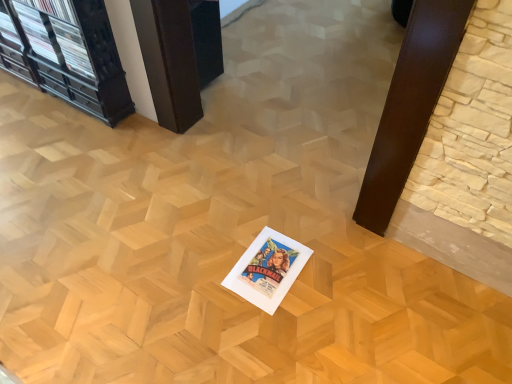
Find the location of a particular element. The height and width of the screenshot is (384, 512). free space to the back side of white paper at center is located at coordinates tap(265, 220).